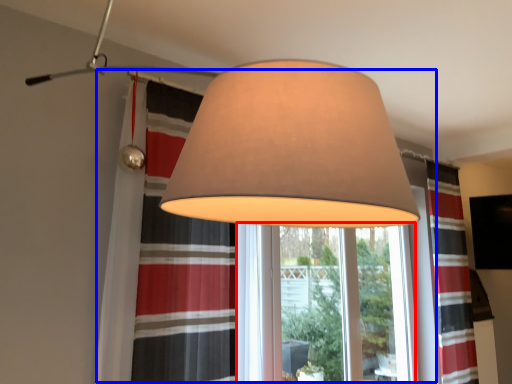
Question: Which object appears farthest to the camera in this image, window frame (highlighted by a red box) or bay window (highlighted by a blue box)?

Choices:
 (A) window frame
 (B) bay window

Answer: (A)